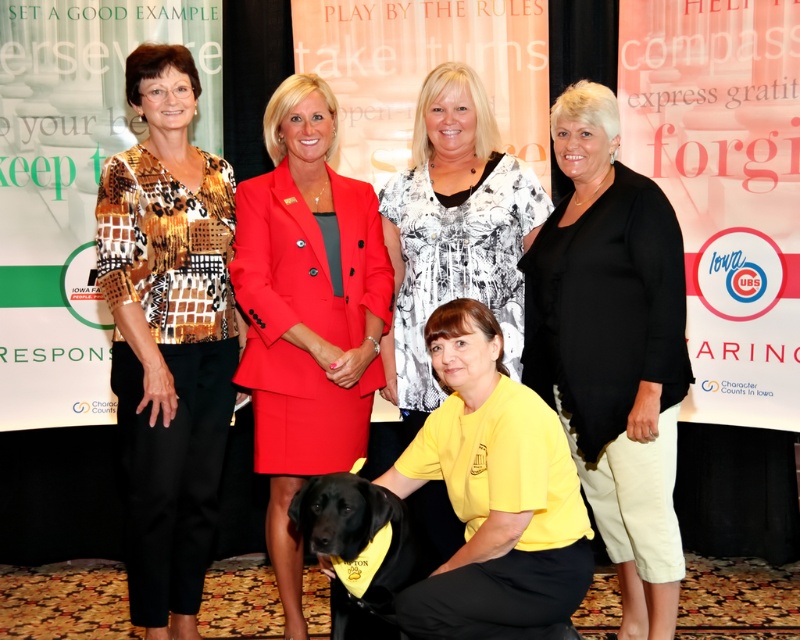
Can you confirm if matte red blazer at center is positioned to the left of yellow matte shirt at lower center?

Correct, you'll find matte red blazer at center to the left of yellow matte shirt at lower center.

Does matte red blazer at center appear on the right side of yellow matte shirt at lower center?

No, matte red blazer at center is not to the right of yellow matte shirt at lower center.

This screenshot has height=640, width=800. What are the coordinates of `matte red blazer at center` in the screenshot? It's located at (306, 312).

Does printed fabric blouse at left have a greater height compared to yellow matte shirt at lower center?

Yes.

Does point (210, 488) come behind point (520, 556)?

Yes.

Which is in front, point (118, 172) or point (476, 593)?

Point (476, 593) is in front.

Image resolution: width=800 pixels, height=640 pixels. What are the coordinates of `printed fabric blouse at left` in the screenshot? It's located at (168, 337).

Consider the image. Between yellow matte shirt at lower center and yellow fabric shirt at center, which one has more height?

With more height is yellow fabric shirt at center.

Is point (558, 634) in front of point (408, 211)?

Yes, it is in front of point (408, 211).

Where is `yellow matte shirt at lower center`? The width and height of the screenshot is (800, 640). yellow matte shirt at lower center is located at coordinates (494, 496).